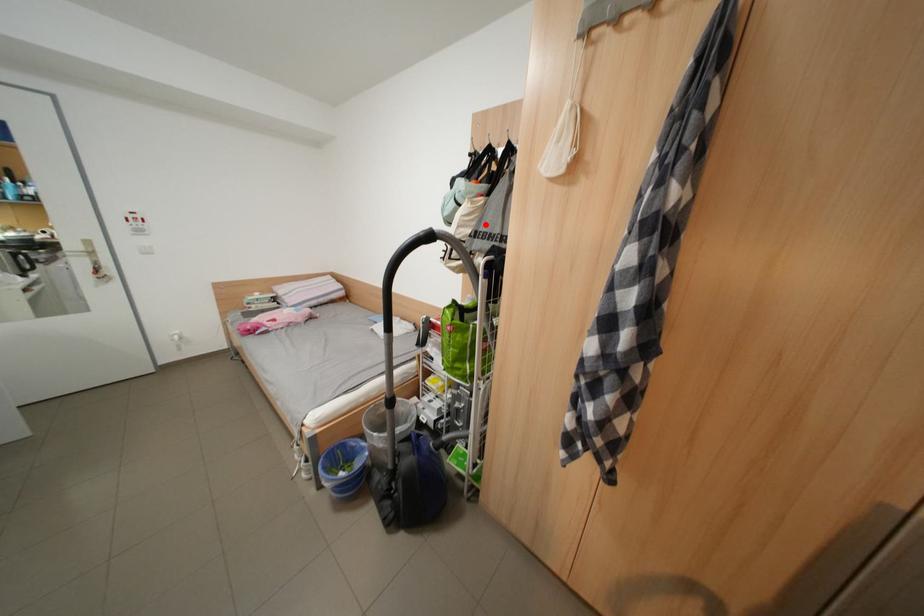
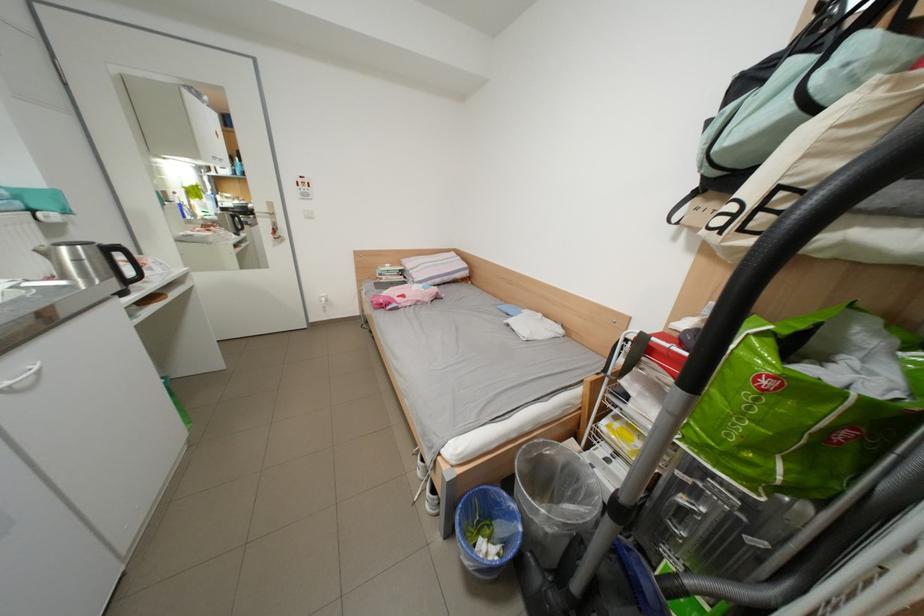
Question: A red point is marked in image1. In image2, is the corresponding 3D point closer to the camera or farther? Reply with the corresponding letter.

Choices:
 (A) The corresponding 3D point is closer.
 (B) The corresponding 3D point is farther.

Answer: (B)